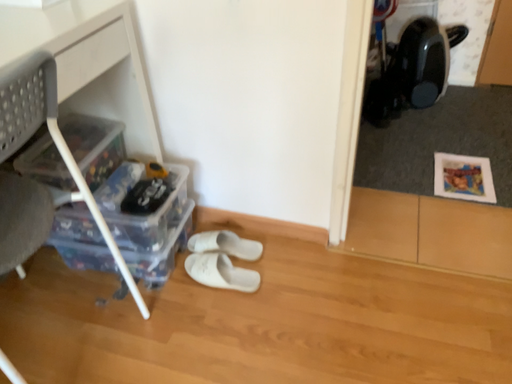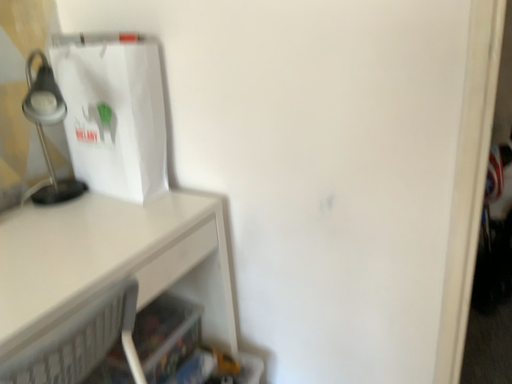
Question: How did the camera likely rotate when shooting the video?

Choices:
 (A) rotated left
 (B) rotated right

Answer: (A)